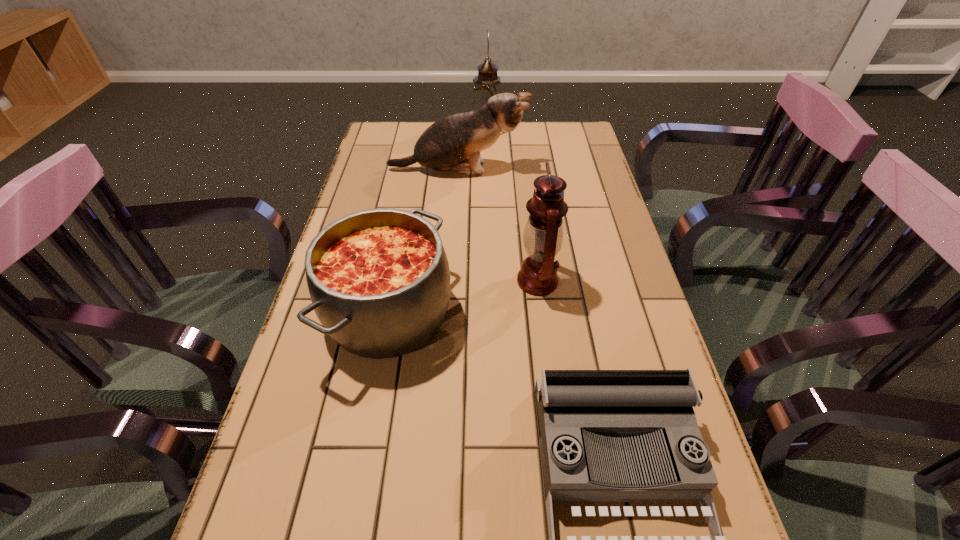
Locate an element on the screen. object at the far edge is located at coordinates (487, 84).

This screenshot has height=540, width=960. I want to click on cat at the left edge, so click(x=453, y=143).

The image size is (960, 540). What are the coordinates of `casserole present at the left edge` in the screenshot? It's located at (379, 280).

The height and width of the screenshot is (540, 960). In the image, there is a desktop. What are the coordinates of `vacant space at the left edge` in the screenshot? It's located at (288, 432).

In order to click on free region at the right edge of the desktop in this screenshot , I will do click(x=582, y=175).

In the image, there is a desktop. What are the coordinates of `vacant area at the far left corner` in the screenshot? It's located at (406, 127).

In the image, there is a desktop. Where is `vacant area at the far right corner`? vacant area at the far right corner is located at coordinates (585, 125).

At what (x,y) coordinates should I click in order to perform the action: click on free space between the right oil lamp and the second shortest object. Please return your answer as a coordinate pair (x, y). Looking at the image, I should click on (463, 297).

Locate an element on the screen. This screenshot has width=960, height=540. free point between the fourth nearest object and the nearer oil lamp is located at coordinates (497, 225).

In order to click on the third closest object to the left oil lamp in this screenshot , I will do `click(543, 235)`.